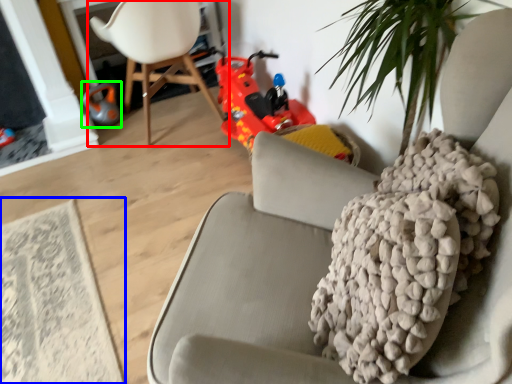
Question: Which object is the farthest from chair (highlighted by a red box)? Choose among these: mat (highlighted by a blue box) or toy (highlighted by a green box).

Choices:
 (A) mat
 (B) toy

Answer: (A)